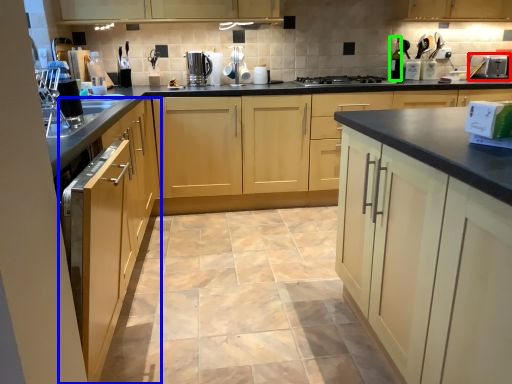
Question: Which is farther away from kitchen appliance (highlighted by a red box)? cabinetry (highlighted by a blue box) or bottle (highlighted by a green box)?

Choices:
 (A) cabinetry
 (B) bottle

Answer: (A)